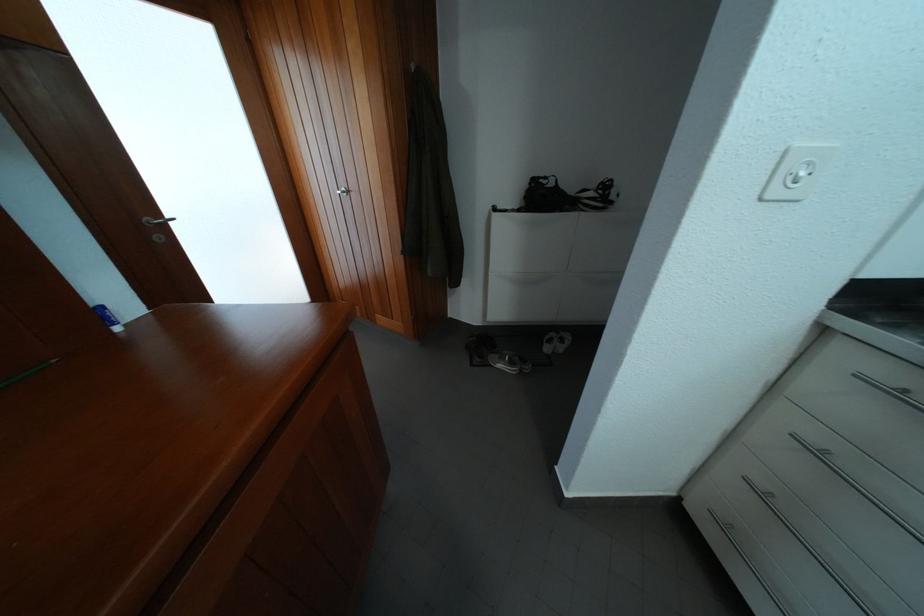
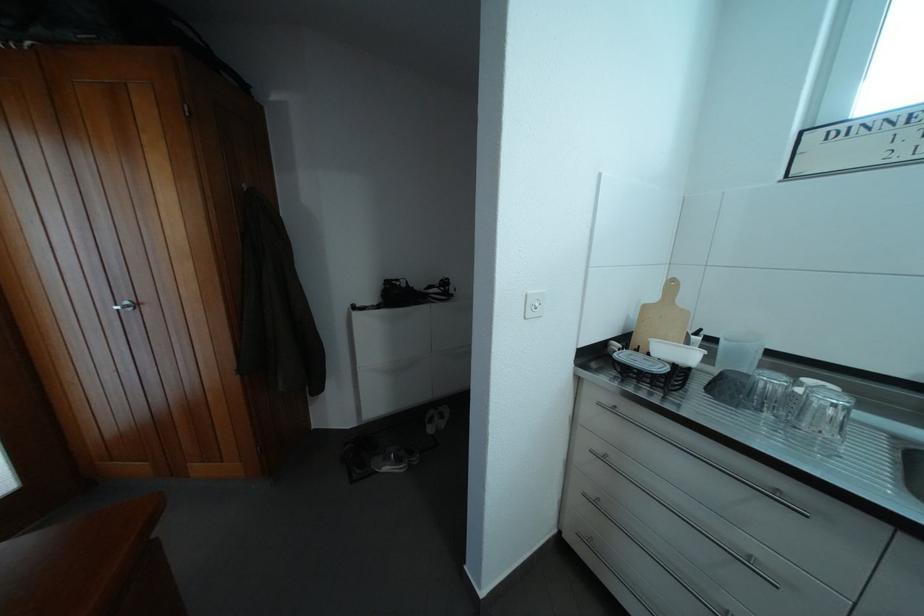
Question: Based on the continuous images, in which direction is the camera rotating? Reply with the corresponding letter.

Choices:
 (A) Left
 (B) Right
 (C) Up
 (D) Down

Answer: (B)